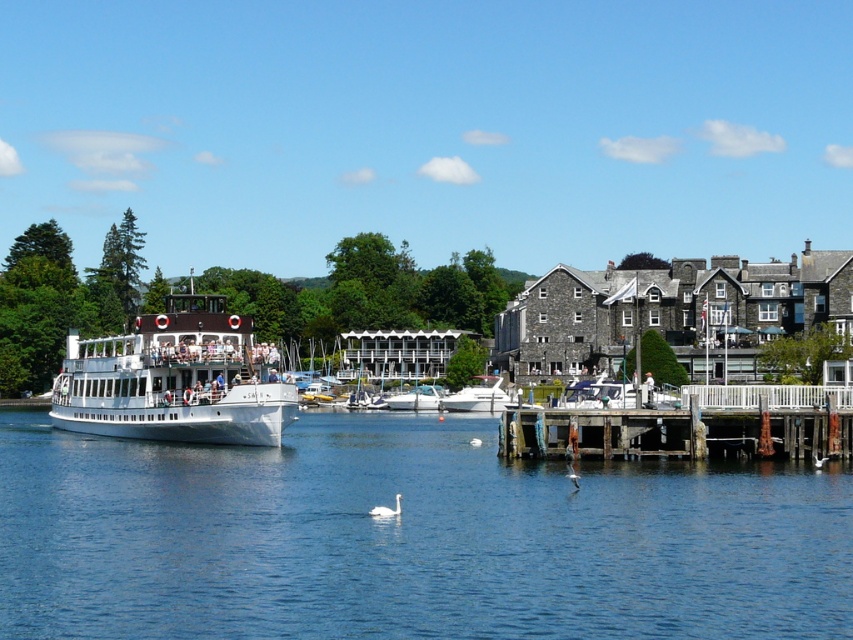
Question: Considering the relative positions of white glossy motorboat at center and white glossy swan at lower center in the image provided, where is white glossy motorboat at center located with respect to white glossy swan at lower center?

Choices:
 (A) above
 (B) below

Answer: (A)

Question: Among these objects, which one is farthest from the camera?

Choices:
 (A) white glossy motorboat at center
 (B) white glossy swan at lower center
 (C) white glossy boat at center
 (D) clear blue water at center

Answer: (C)

Question: Which point appears closest to the camera in this image?

Choices:
 (A) (683, 404)
 (B) (454, 564)
 (C) (392, 408)

Answer: (B)

Question: Based on their relative distances, which object is nearer to the clear blue water at center?

Choices:
 (A) white glossy ferry at left
 (B) white glossy boat at center
 (C) wooden dock at lower right

Answer: (C)

Question: Where is white glossy boat at center located in relation to white glossy swan at lower center in the image?

Choices:
 (A) left
 (B) right

Answer: (A)

Question: Can you confirm if white glossy ferry at left is bigger than wooden dock at lower right?

Choices:
 (A) no
 (B) yes

Answer: (B)